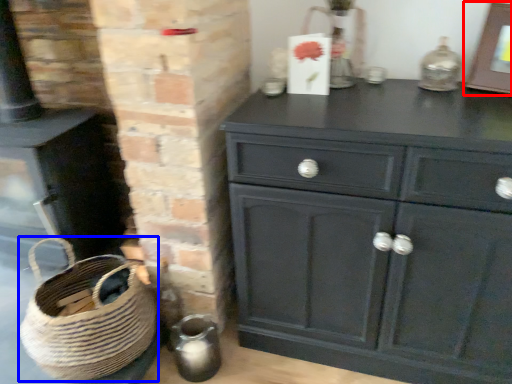
Question: Which point is further to the camera, picture frame (highlighted by a red box) or basket (highlighted by a blue box)?

Choices:
 (A) picture frame
 (B) basket

Answer: (B)